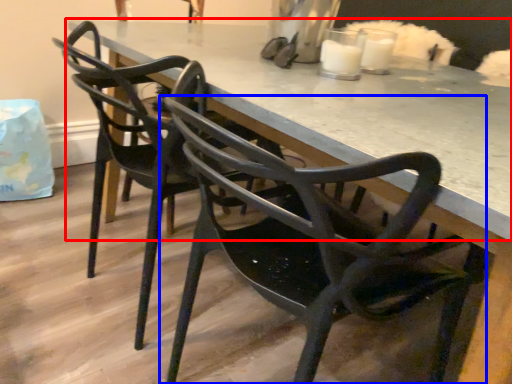
Question: Which point is further to the camera, table (highlighted by a red box) or chair (highlighted by a blue box)?

Choices:
 (A) table
 (B) chair

Answer: (A)